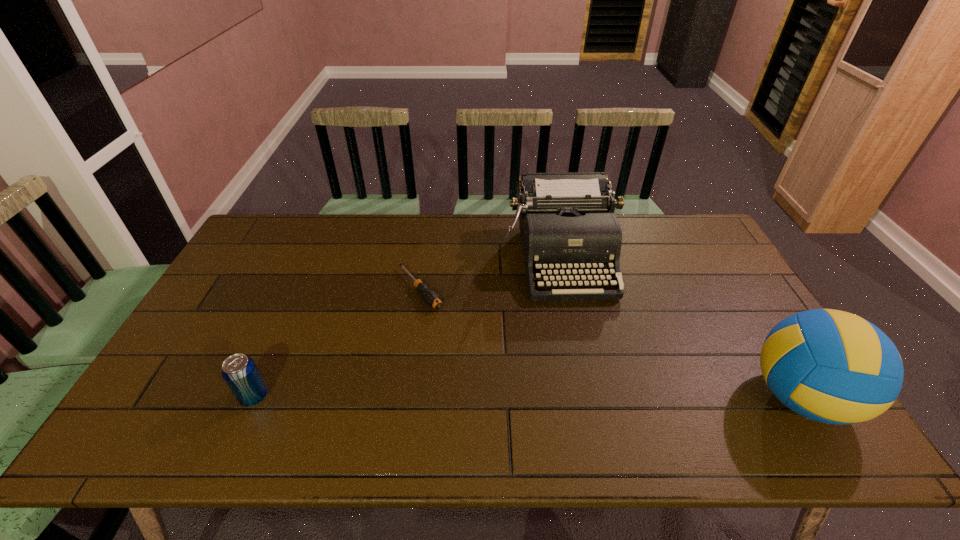
Where is `blank region between the second object from left to right and the third object from left to right`? This screenshot has width=960, height=540. blank region between the second object from left to right and the third object from left to right is located at coordinates (491, 274).

At what (x,y) coordinates should I click in order to perform the action: click on free spot between the rightmost object and the shortest object. Please return your answer as a coordinate pair (x, y). The height and width of the screenshot is (540, 960). Looking at the image, I should click on (610, 343).

Locate an element on the screen. This screenshot has height=540, width=960. free space between the second object from right to left and the second shortest object is located at coordinates (408, 327).

This screenshot has height=540, width=960. What are the coordinates of `free spot between the third tallest object and the shortest object` in the screenshot? It's located at (337, 342).

Select which object appears as the second closest to the beer can. Please provide its 2D coordinates. Your answer should be formatted as a tuple, i.e. [(x, y)], where the tuple contains the x and y coordinates of a point satisfying the conditions above.

[(568, 228)]

At what (x,y) coordinates should I click in order to perform the action: click on the third closest object to the rightmost object. Please return your answer as a coordinate pair (x, y). This screenshot has width=960, height=540. Looking at the image, I should click on (239, 371).

The height and width of the screenshot is (540, 960). Identify the location of free point that satisfies the following two spatial constraints: 1. on the front side of the volleyball; 2. on the left side of the leftmost object. [x=254, y=397].

At what (x,y) coordinates should I click in order to perform the action: click on free location that satisfies the following two spatial constraints: 1. on the back side of the beer can; 2. on the right side of the third object from left to right. Please return your answer as a coordinate pair (x, y). This screenshot has height=540, width=960. Looking at the image, I should click on (315, 259).

In order to click on vacant space that satisfies the following two spatial constraints: 1. on the back side of the screwdriver; 2. on the right side of the beer can in this screenshot , I will do `click(301, 289)`.

You are a GUI agent. You are given a task and a screenshot of the screen. Output one action in this format:
    pyautogui.click(x=<x>, y=<y>)
    Task: Click on the vacant space that satisfies the following two spatial constraints: 1. on the front side of the rightmost object; 2. on the right side of the third object from right to left
    The height and width of the screenshot is (540, 960).
    Given the screenshot: What is the action you would take?
    pyautogui.click(x=404, y=397)